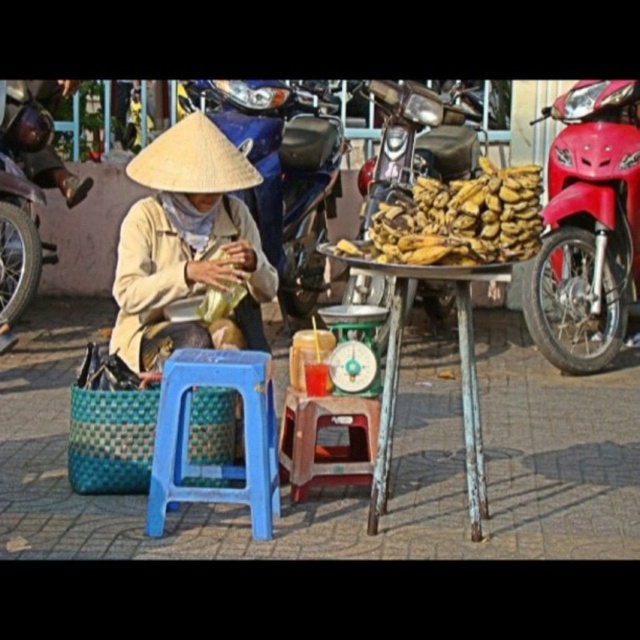
Question: Can you confirm if yellow matte bananas at center is smaller than brushed metal motorcycle at left?

Choices:
 (A) no
 (B) yes

Answer: (B)

Question: Which of the following is the closest to the observer?

Choices:
 (A) blue plastic stool at lower center
 (B) matte straw hat at center
 (C) wooden stool at center

Answer: (A)

Question: Does shiny red motorcycle at right appear on the left side of brushed metal motorcycle at left?

Choices:
 (A) yes
 (B) no

Answer: (B)

Question: Is shiny red motorcycle at right further to the viewer compared to brushed metal motorcycle at left?

Choices:
 (A) yes
 (B) no

Answer: (B)

Question: Among these objects, which one is nearest to the camera?

Choices:
 (A) metallic silver motorcycle at upper center
 (B) brushed metal motorcycle at left

Answer: (B)

Question: Which of the following is the farthest from the observer?

Choices:
 (A) (429, 106)
 (B) (476, 460)
 (C) (177, 422)
 (D) (209, 131)

Answer: (A)